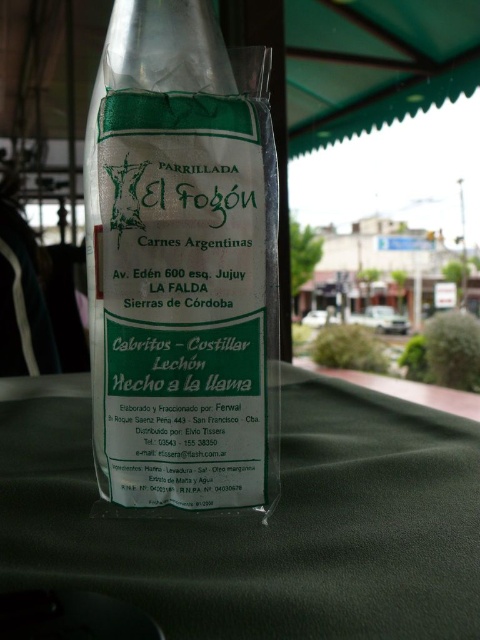
Question: Is transparent plastic bag at center wider than green fabric table at center?

Choices:
 (A) yes
 (B) no

Answer: (B)

Question: Can you confirm if transparent plastic bag at center is smaller than green fabric table at center?

Choices:
 (A) yes
 (B) no

Answer: (A)

Question: Can you confirm if transparent plastic bag at center is wider than green fabric table at center?

Choices:
 (A) yes
 (B) no

Answer: (B)

Question: Which point is closer to the camera?

Choices:
 (A) (335, 401)
 (B) (101, 428)

Answer: (B)